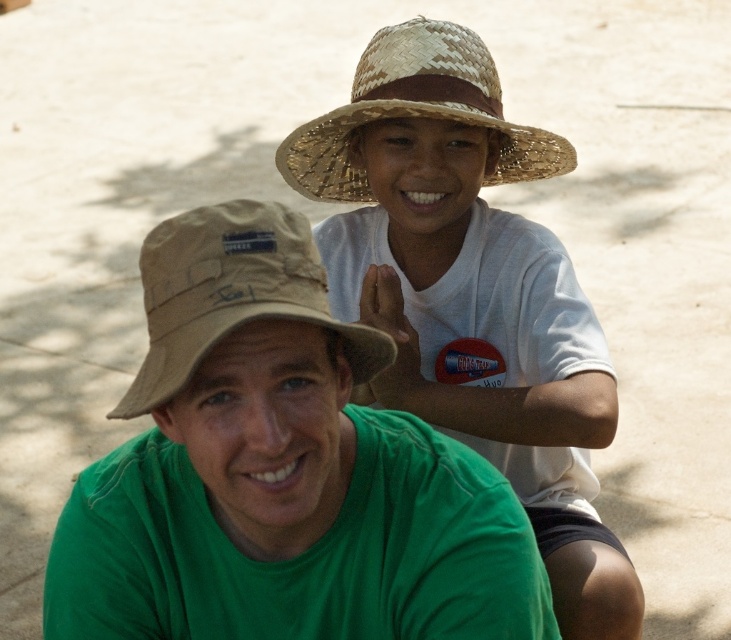
Is green cotton shirt at center further to camera compared to natural straw hat at upper center?

No, it is not.

Where is `green cotton shirt at center`? green cotton shirt at center is located at coordinates (279, 472).

Is natural straw hat at upper center to the right of straw hat at upper center from the viewer's perspective?

Yes, natural straw hat at upper center is to the right of straw hat at upper center.

Can you confirm if natural straw hat at upper center is positioned below straw hat at upper center?

Correct, natural straw hat at upper center is located below straw hat at upper center.

The height and width of the screenshot is (640, 731). Describe the element at coordinates (471, 292) in the screenshot. I see `natural straw hat at upper center` at that location.

Locate an element on the screen. The height and width of the screenshot is (640, 731). natural straw hat at upper center is located at coordinates (471, 292).

Between natural straw hat at upper center and woven straw hat at upper center, which one is positioned higher?

woven straw hat at upper center

Measure the distance between point [491,228] and camera.

They are 8.91 feet apart.

Locate an element on the screen. The width and height of the screenshot is (731, 640). natural straw hat at upper center is located at coordinates (471, 292).